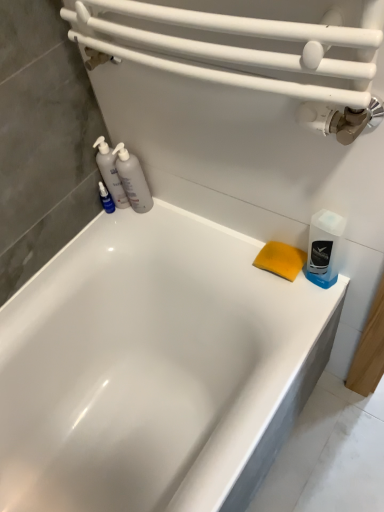
Where is `vacant area in front of blue translucent bottle at left`? This screenshot has height=512, width=384. vacant area in front of blue translucent bottle at left is located at coordinates (109, 234).